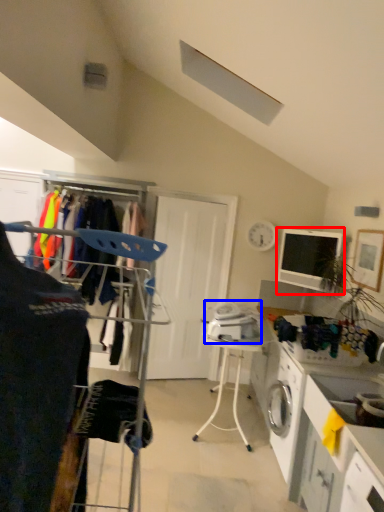
Question: Among these objects, which one is nearest to the camera, computer monitor (highlighted by a red box) or appliance (highlighted by a blue box)?

Choices:
 (A) computer monitor
 (B) appliance

Answer: (B)